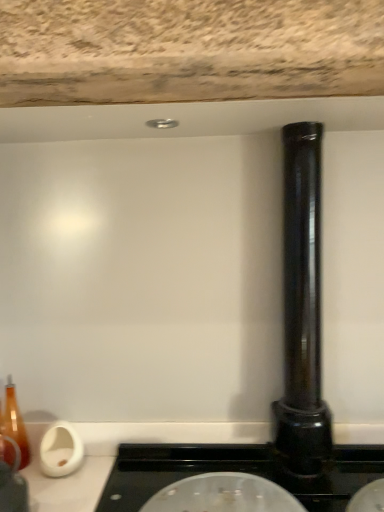
Question: From the image's perspective, is black glossy pipe at right located above or below transparent glass lid at center?

Choices:
 (A) above
 (B) below

Answer: (A)

Question: Is black glossy pipe at right taller or shorter than transparent glass lid at center?

Choices:
 (A) short
 (B) tall

Answer: (B)

Question: Is black glossy pipe at right in front of or behind transparent glass lid at center in the image?

Choices:
 (A) front
 (B) behind

Answer: (B)

Question: Considering the positions of transparent glass lid at center and black glossy pipe at right in the image, is transparent glass lid at center bigger or smaller than black glossy pipe at right?

Choices:
 (A) big
 (B) small

Answer: (B)

Question: From the image's perspective, is transparent glass lid at center positioned above or below black glossy pipe at right?

Choices:
 (A) below
 (B) above

Answer: (A)

Question: Would you say transparent glass lid at center is inside or outside black glossy pipe at right?

Choices:
 (A) inside
 (B) outside

Answer: (B)

Question: Relative to black glossy pipe at right, is transparent glass lid at center in front or behind?

Choices:
 (A) behind
 (B) front

Answer: (B)